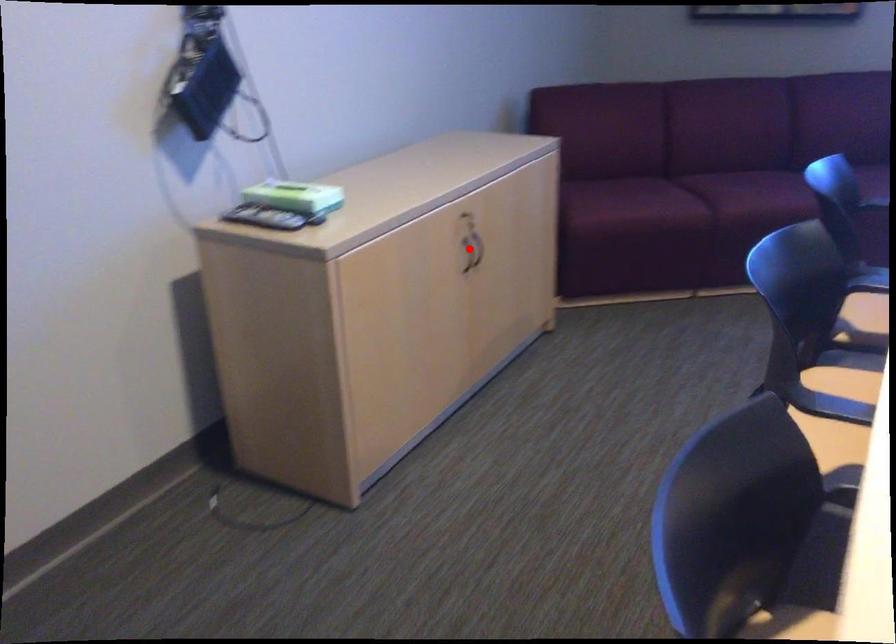
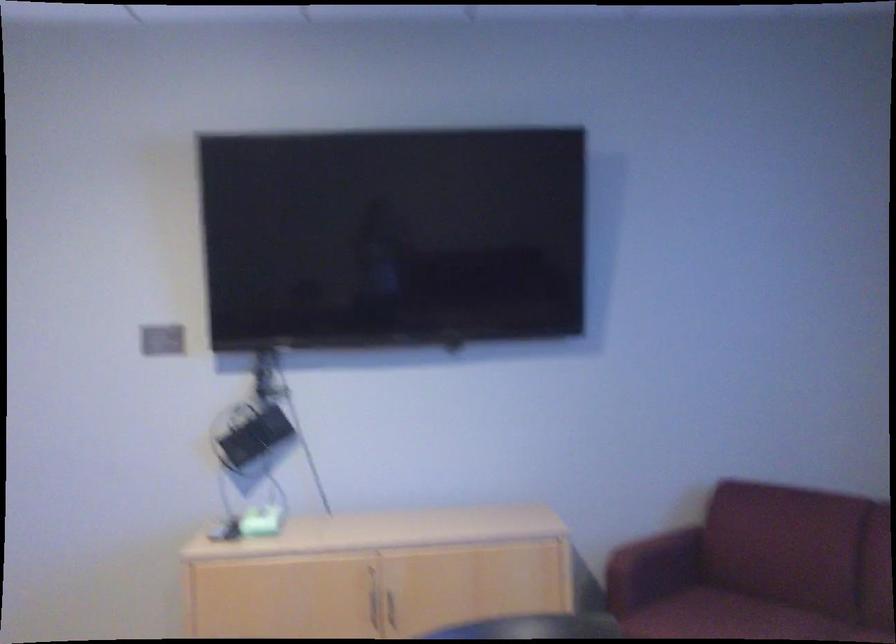
Where in the second image is the point corresponding to the highlighted location from the first image?

(392, 607)